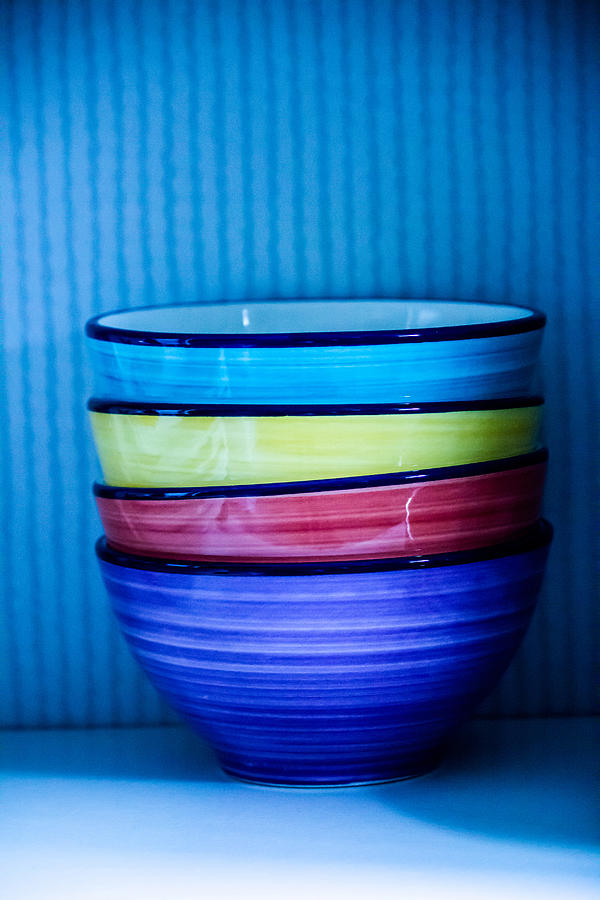
What are the coordinates of `dark blue bowl` in the screenshot? It's located at (327, 664).